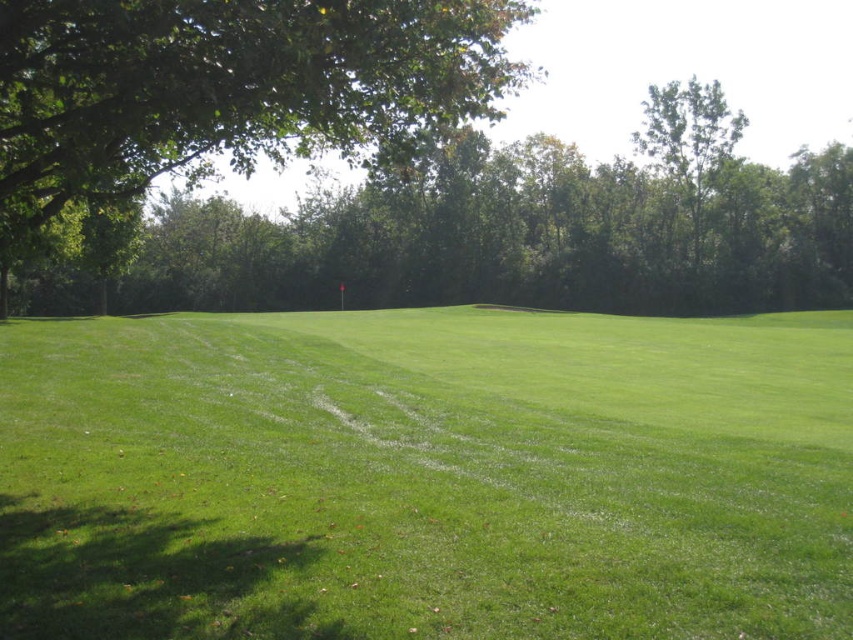
You are a golfer standing on the green grass at center and want to hit the ball towards the green leafy tree at upper right. Since the tree is behind the grass, will the tree block your view of the flag? Please explain.

The green grass at center is in front of the green leafy tree at upper right, so the tree will block your view of the flag if it is positioned behind the grass.

You are a golfer standing at the green grass at center. You want to hit a ball to the green leafy tree at upper left. If your maximum hitting distance is 30 feet, can you reach the tree with one shot?

The distance between the green grass at center and the green leafy tree at upper left is 31.62 feet, which is slightly beyond your maximum hitting distance of 30 feet. Therefore, you cannot reach the tree with one shot.